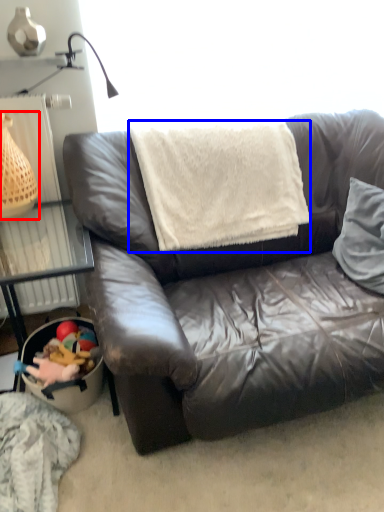
Question: Which point is closer to the camera, basket (highlighted by a red box) or blanket (highlighted by a blue box)?

Choices:
 (A) basket
 (B) blanket

Answer: (A)